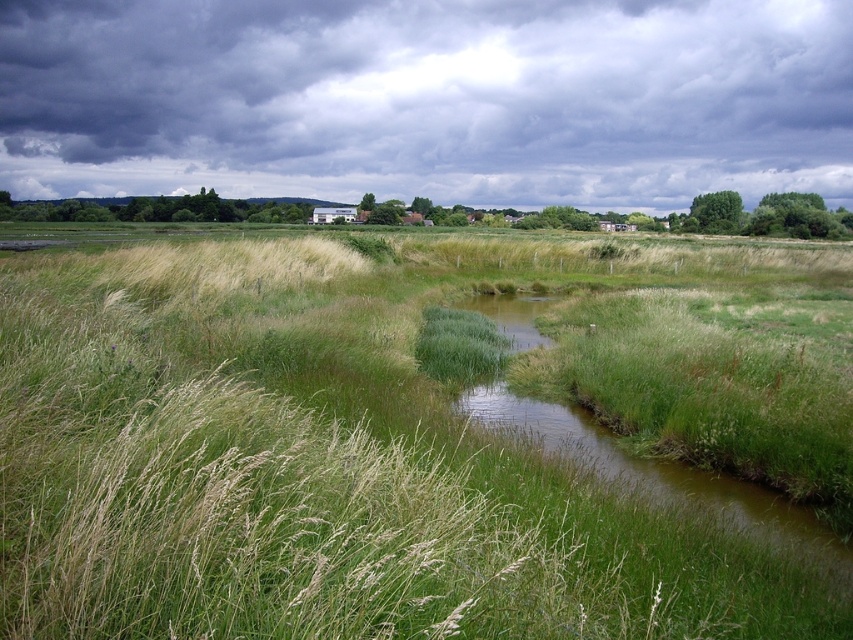
Question: Is green grassy at center to the left of dark gray cloud at upper center from the viewer's perspective?

Choices:
 (A) yes
 (B) no

Answer: (A)

Question: Is green grassy at center positioned at the back of dark gray cloud at upper center?

Choices:
 (A) yes
 (B) no

Answer: (B)

Question: Does green grassy at center appear on the left side of dark gray cloud at upper center?

Choices:
 (A) yes
 (B) no

Answer: (A)

Question: Which of the following is the closest to the observer?

Choices:
 (A) (131, 401)
 (B) (614, 188)

Answer: (A)

Question: Which point is farther from the camera taking this photo?

Choices:
 (A) (10, 490)
 (B) (508, 109)

Answer: (B)